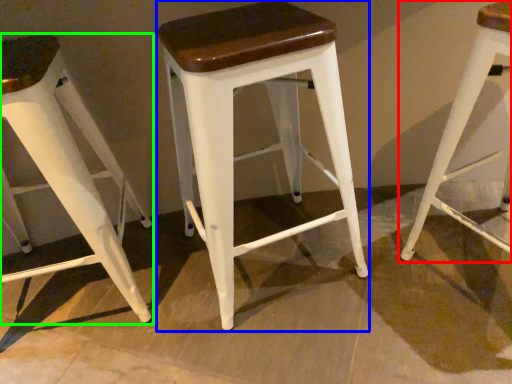
Question: Considering the real-world distances, which object is closest to stool (highlighted by a red box)? stool (highlighted by a blue box) or stool (highlighted by a green box).

Choices:
 (A) stool
 (B) stool

Answer: (A)